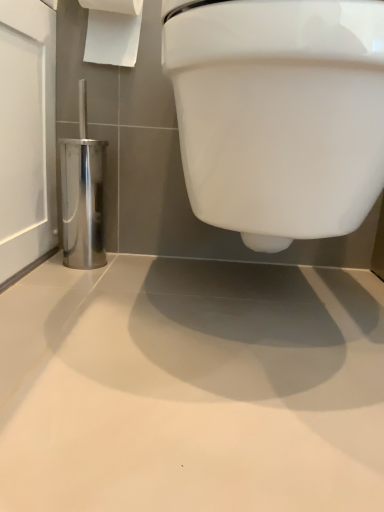
Question: Should I look upward or downward to see polished metallic toilet brush holder at left?

Choices:
 (A) down
 (B) up

Answer: (B)

Question: Is polished metallic toilet brush holder at left wider than white paper at upper left?

Choices:
 (A) no
 (B) yes

Answer: (A)

Question: Can you confirm if polished metallic toilet brush holder at left is shorter than white paper at upper left?

Choices:
 (A) no
 (B) yes

Answer: (A)

Question: From the image's perspective, is polished metallic toilet brush holder at left below white paper at upper left?

Choices:
 (A) no
 (B) yes

Answer: (B)

Question: Is polished metallic toilet brush holder at left turned away from white paper at upper left?

Choices:
 (A) yes
 (B) no

Answer: (B)

Question: Considering the relative positions of polished metallic toilet brush holder at left and white paper at upper left in the image provided, is polished metallic toilet brush holder at left behind white paper at upper left?

Choices:
 (A) yes
 (B) no

Answer: (A)

Question: Is polished metallic toilet brush holder at left located outside white paper at upper left?

Choices:
 (A) yes
 (B) no

Answer: (A)

Question: Can you see polished metallic toilet brush holder at left touching white glossy toilet at upper center?

Choices:
 (A) yes
 (B) no

Answer: (B)

Question: From the image's perspective, is polished metallic toilet brush holder at left over white glossy toilet at upper center?

Choices:
 (A) no
 (B) yes

Answer: (B)

Question: Is polished metallic toilet brush holder at left to the right of white glossy toilet at upper center from the viewer's perspective?

Choices:
 (A) no
 (B) yes

Answer: (A)

Question: Is polished metallic toilet brush holder at left facing away from white glossy toilet at upper center?

Choices:
 (A) yes
 (B) no

Answer: (B)

Question: Is polished metallic toilet brush holder at left taller than white glossy toilet at upper center?

Choices:
 (A) yes
 (B) no

Answer: (B)

Question: From a real-world perspective, is polished metallic toilet brush holder at left physically below white glossy toilet at upper center?

Choices:
 (A) yes
 (B) no

Answer: (A)

Question: Are white paper at upper left and polished metallic toilet brush holder at left making contact?

Choices:
 (A) yes
 (B) no

Answer: (B)